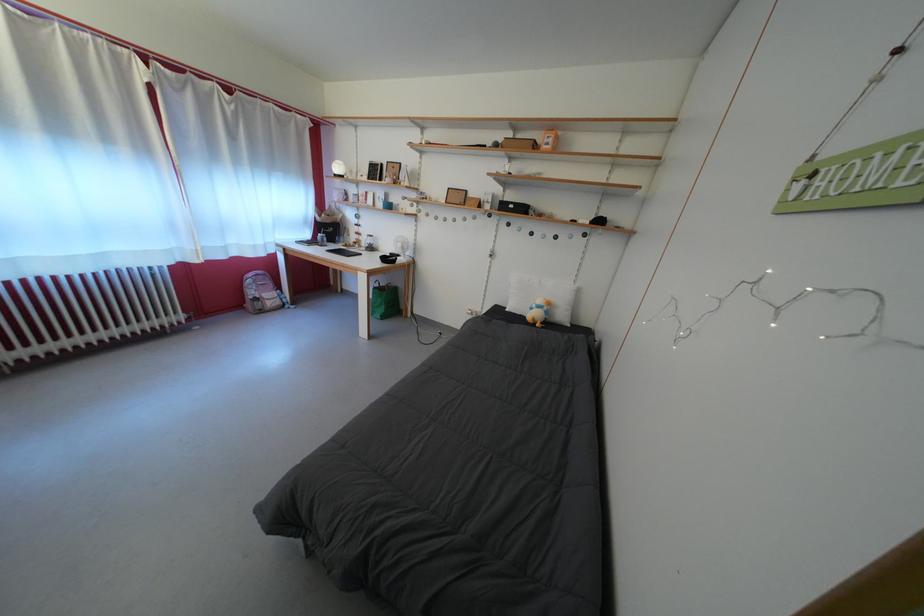
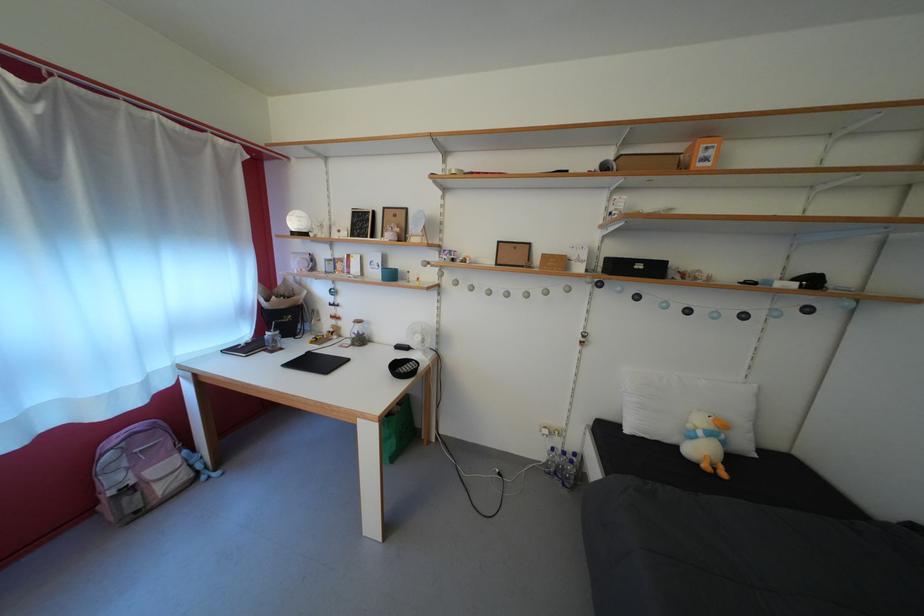
The point at (373, 246) is marked in the first image. Where is the corresponding point in the second image?

(358, 334)